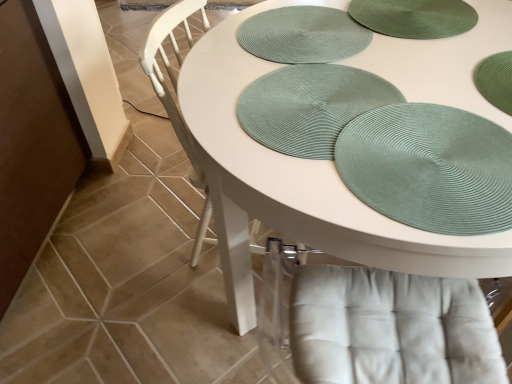
The image size is (512, 384). Find the location of `vacant space in green textured placemat at upper right (from a real-world perspective)`. vacant space in green textured placemat at upper right (from a real-world perspective) is located at coordinates [425, 149].